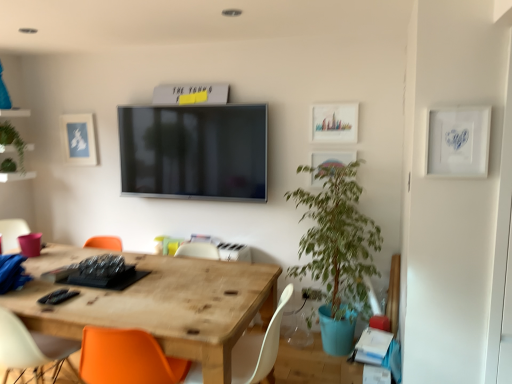
Question: Does matte blue paper at upper left have a greater width compared to green leafy plant at left?

Choices:
 (A) yes
 (B) no

Answer: (B)

Question: From a real-world perspective, is matte blue paper at upper left physically above green leafy plant at left?

Choices:
 (A) yes
 (B) no

Answer: (B)

Question: Does matte blue paper at upper left appear on the right side of green leafy plant at left?

Choices:
 (A) yes
 (B) no

Answer: (A)

Question: Considering the relative sizes of matte blue paper at upper left and green leafy plant at left in the image provided, is matte blue paper at upper left shorter than green leafy plant at left?

Choices:
 (A) no
 (B) yes

Answer: (A)

Question: Are matte blue paper at upper left and green leafy plant at left located far from each other?

Choices:
 (A) no
 (B) yes

Answer: (A)

Question: Based on their positions, is matte blue paper at upper left located to the left or right of green leafy plant in blue pot at right?

Choices:
 (A) right
 (B) left

Answer: (B)

Question: Looking at the image, does matte blue paper at upper left seem bigger or smaller compared to green leafy plant in blue pot at right?

Choices:
 (A) small
 (B) big

Answer: (A)

Question: From a real-world perspective, is matte blue paper at upper left above or below green leafy plant in blue pot at right?

Choices:
 (A) below
 (B) above

Answer: (B)

Question: From the image's perspective, relative to green leafy plant in blue pot at right, is matte blue paper at upper left above or below?

Choices:
 (A) below
 (B) above

Answer: (B)

Question: Would you say green leafy plant in blue pot at right is inside or outside wooden table at center?

Choices:
 (A) inside
 (B) outside

Answer: (B)

Question: Is green leafy plant in blue pot at right bigger or smaller than wooden table at center?

Choices:
 (A) small
 (B) big

Answer: (A)

Question: Is green leafy plant in blue pot at right in front of or behind wooden table at center in the image?

Choices:
 (A) front
 (B) behind

Answer: (B)

Question: From a real-world perspective, is green leafy plant in blue pot at right physically located above or below wooden table at center?

Choices:
 (A) above
 (B) below

Answer: (A)

Question: Is point 192,380 positioned closer to the camera than point 20,142?

Choices:
 (A) farther
 (B) closer

Answer: (B)

Question: Based on their positions, is white matte chair at lower center located to the left or right of green leafy plant at left?

Choices:
 (A) right
 (B) left

Answer: (A)